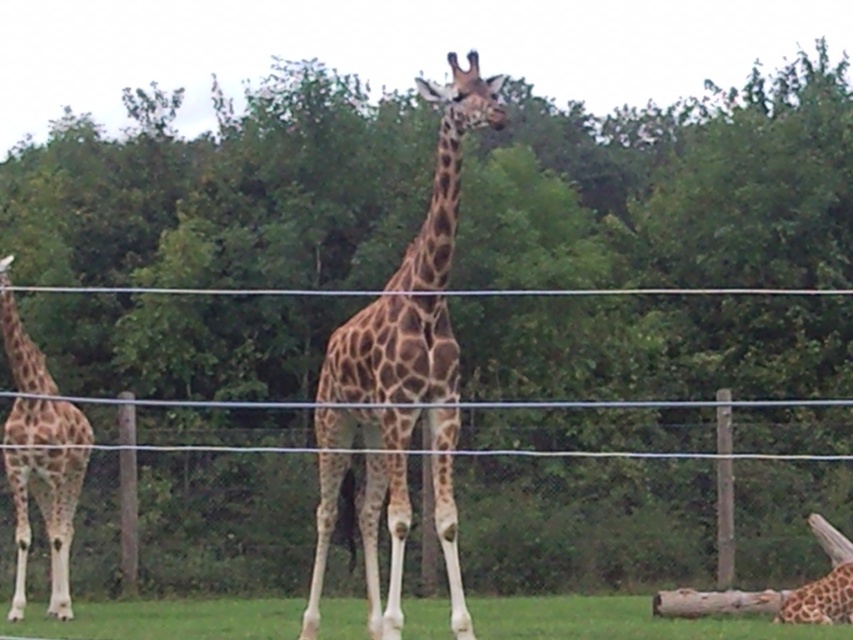
Between spotted fur giraffe at left and spotted fur giraffe at lower right, which one has less height?

Standing shorter between the two is spotted fur giraffe at lower right.

Measure the distance from spotted fur giraffe at left to spotted fur giraffe at lower right.

spotted fur giraffe at left is 5.46 meters away from spotted fur giraffe at lower right.

Which is in front, point (32, 356) or point (830, 586)?

Point (830, 586)

Identify the location of spotted fur giraffe at left. The height and width of the screenshot is (640, 853). (45, 486).

Who is lower down, spotted fur giraffe at center or spotted fur giraffe at lower right?

spotted fur giraffe at lower right is below.

Does point (407, 269) lie behind point (833, 582)?

No, it is in front of (833, 582).

Is point (374, 515) farther from camera compared to point (809, 592)?

No, it is in front of (809, 592).

Find the location of a particular element. The height and width of the screenshot is (640, 853). spotted fur giraffe at center is located at coordinates (392, 353).

Between wire mesh fence at center and spotted fur giraffe at left, which one appears on the right side from the viewer's perspective?

From the viewer's perspective, wire mesh fence at center appears more on the right side.

Who is positioned more to the left, wire mesh fence at center or spotted fur giraffe at left?

From the viewer's perspective, spotted fur giraffe at left appears more on the left side.

Measure the distance between point [331,561] and camera.

The distance of point [331,561] from camera is 14.88 meters.

Locate an element on the screen. wire mesh fence at center is located at coordinates (585, 497).